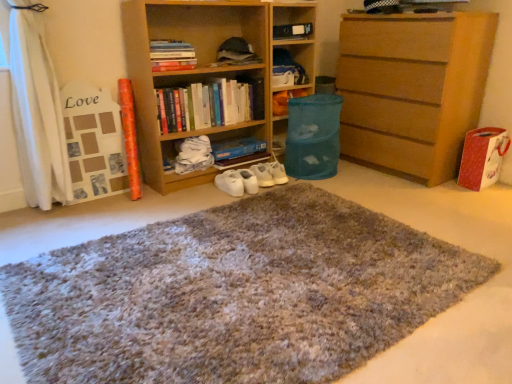
Where is `free space between shaggy carpet at center and white matte sneakers at center`? The image size is (512, 384). free space between shaggy carpet at center and white matte sneakers at center is located at coordinates (170, 211).